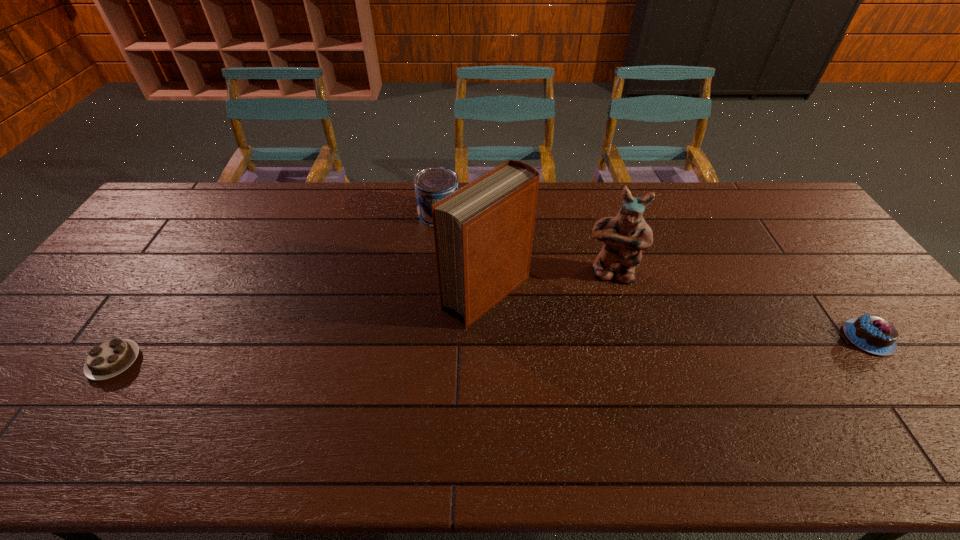
At what (x,y) coordinates should I click in order to perform the action: click on free area in between the leftmost object and the figurine. Please return your answer as a coordinate pair (x, y). The height and width of the screenshot is (540, 960). Looking at the image, I should click on (363, 318).

I want to click on vacant space in between the figurine and the shorter chocolate cake, so click(363, 318).

The width and height of the screenshot is (960, 540). I want to click on free space between the fourth shortest object and the tallest object, so [x=548, y=284].

You are a GUI agent. You are given a task and a screenshot of the screen. Output one action in this format:
    pyautogui.click(x=<x>, y=<y>)
    Task: Click on the free spot between the hardback book and the shorter chocolate cake
    The height and width of the screenshot is (540, 960).
    Given the screenshot: What is the action you would take?
    pyautogui.click(x=300, y=328)

Identify the location of free point between the rightmost object and the shorter chocolate cake. (492, 350).

Where is `free space between the leftmost object and the taller chocolate cake`? free space between the leftmost object and the taller chocolate cake is located at coordinates (492, 350).

Identify the location of free space between the left chocolate cake and the rightmost object. (492, 350).

Identify the location of the third closest object to the farthest object. The image size is (960, 540). (111, 358).

This screenshot has width=960, height=540. I want to click on object that is the second closest to the farthest object, so click(625, 236).

At what (x,y) coordinates should I click in order to perform the action: click on blank area in the image that satisfies the following two spatial constraints: 1. on the front side of the fourth object from left to right; 2. on the right side of the rightmost object. Please return your answer as a coordinate pair (x, y). Looking at the image, I should click on (629, 338).